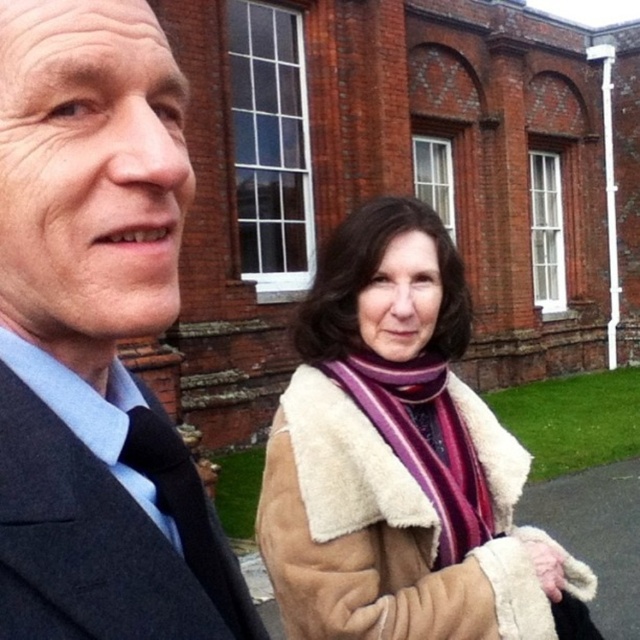
Question: Which of the following is the closest to the observer?

Choices:
 (A) purple striped scarf at center
 (B) sheepskin coat at center
 (C) dark gray suit at left
 (D) dark blue woolen suit at left

Answer: (D)

Question: Is dark gray suit at left thinner than dark blue woolen suit at left?

Choices:
 (A) yes
 (B) no

Answer: (A)

Question: Which object appears closest to the camera in this image?

Choices:
 (A) sheepskin coat at center
 (B) dark blue woolen suit at left
 (C) purple striped scarf at center
 (D) dark gray suit at left

Answer: (B)

Question: Which object appears farthest from the camera in this image?

Choices:
 (A) sheepskin coat at center
 (B) dark gray suit at left
 (C) purple striped scarf at center
 (D) dark blue woolen suit at left

Answer: (C)

Question: Does dark gray suit at left appear on the left side of dark blue woolen suit at left?

Choices:
 (A) no
 (B) yes

Answer: (A)

Question: Does sheepskin coat at center have a larger size compared to purple striped scarf at center?

Choices:
 (A) yes
 (B) no

Answer: (A)